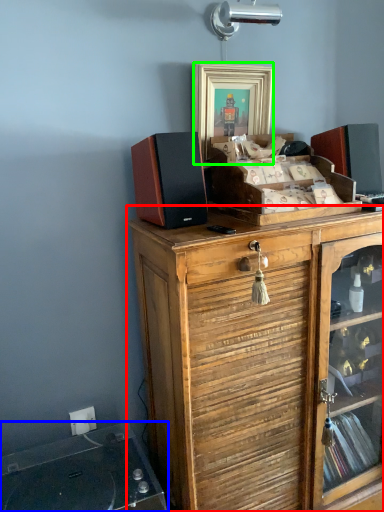
Question: Which object is the closest to the cabinetry (highlighted by a red box)? Choose among these: wide (highlighted by a blue box) or picture frame (highlighted by a green box).

Choices:
 (A) wide
 (B) picture frame

Answer: (A)